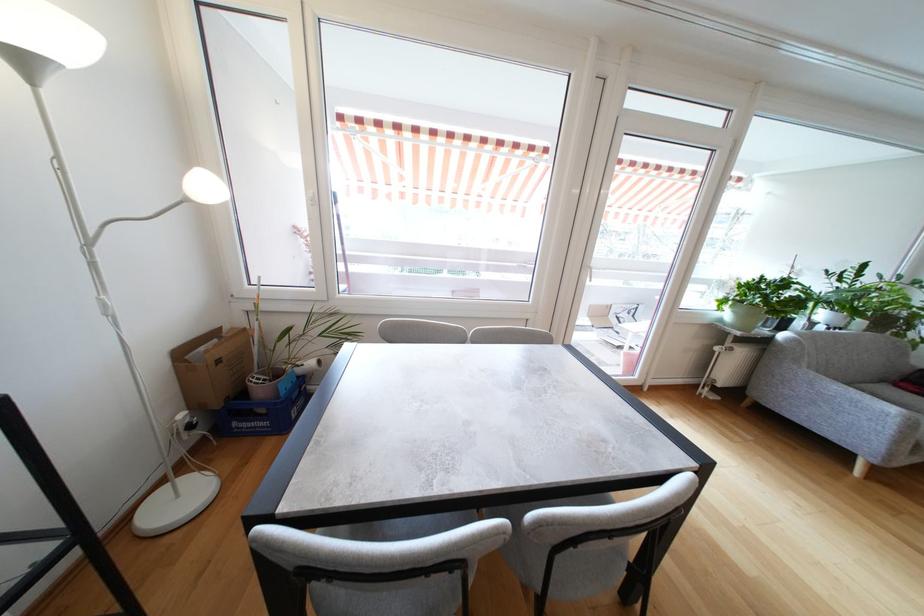
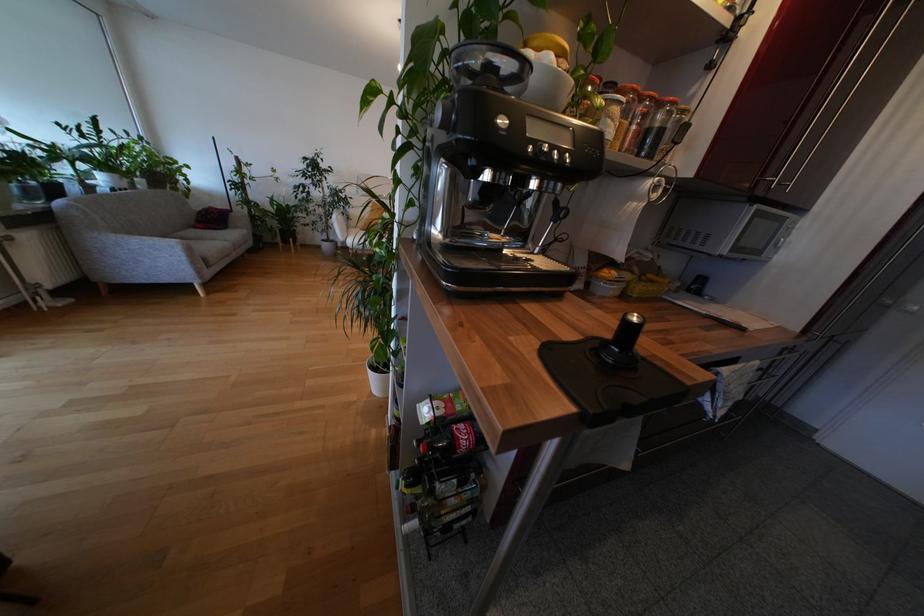
The images are taken continuously from a first-person perspective. In which direction is your viewpoint rotating?

The rotation direction of the camera is right-down.